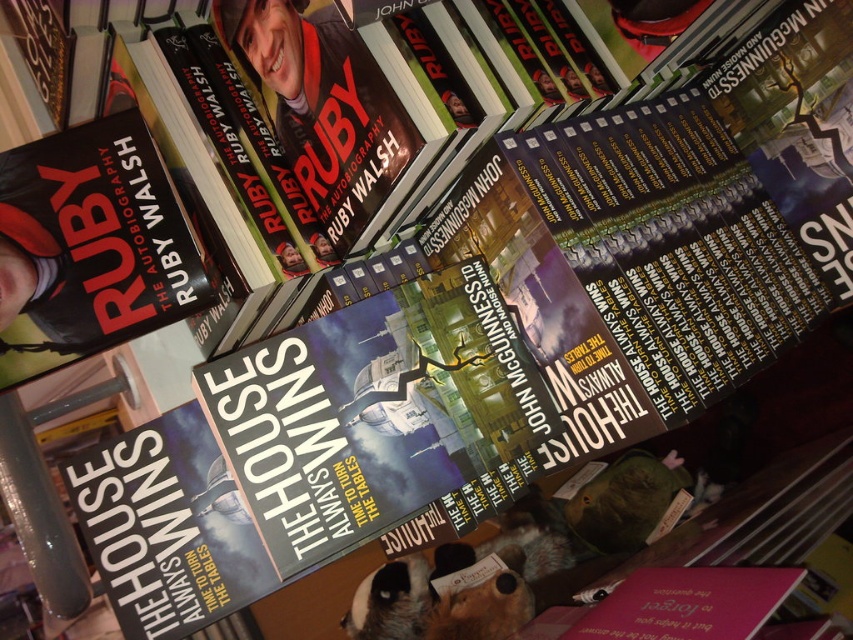
Question: In this image, where is matte black book at upper left located relative to hardcover book at center?

Choices:
 (A) right
 (B) left

Answer: (B)

Question: Is matte black book at upper left bigger than hardcover book at center?

Choices:
 (A) no
 (B) yes

Answer: (B)

Question: Is matte black book at upper left to the right of hardcover book at center from the viewer's perspective?

Choices:
 (A) no
 (B) yes

Answer: (A)

Question: Among these points, which one is farthest from the camera?

Choices:
 (A) (158, 509)
 (B) (200, 300)

Answer: (A)

Question: Which of the following is the farthest from the observer?

Choices:
 (A) click(x=62, y=344)
 (B) click(x=204, y=429)

Answer: (B)